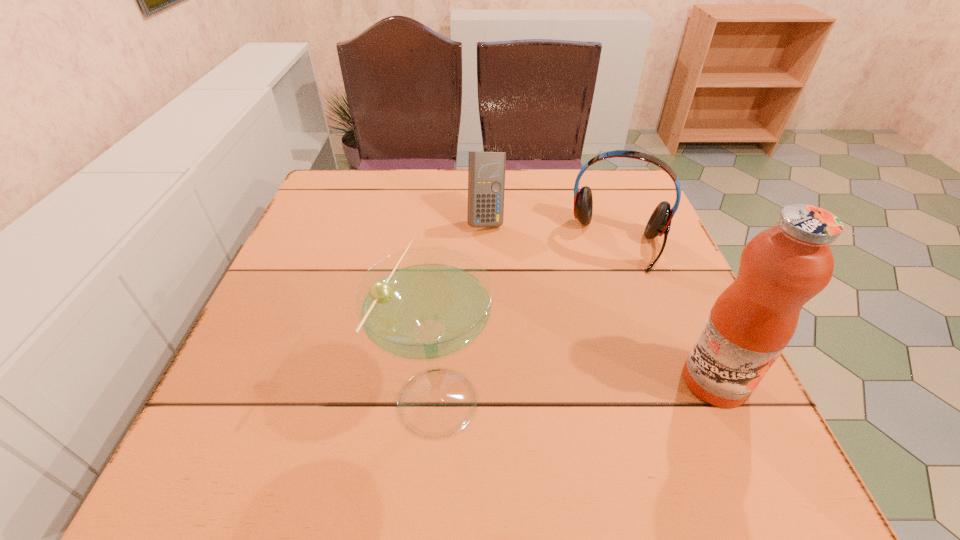
This screenshot has width=960, height=540. I want to click on free space between the headset and the tallest object, so click(x=667, y=312).

The height and width of the screenshot is (540, 960). I want to click on free area in between the fruit juice and the calculator, so click(600, 300).

Identify the location of free space between the martini and the fruit juice. (576, 388).

Where is `object that can be found as the closest to the tallest object`? Image resolution: width=960 pixels, height=540 pixels. object that can be found as the closest to the tallest object is located at coordinates (659, 223).

Select which object appears as the third closest to the headset. Please provide its 2D coordinates. Your answer should be formatted as a tuple, i.e. [(x, y)], where the tuple contains the x and y coordinates of a point satisfying the conditions above.

[(425, 304)]

Where is `free spot that satisfies the following two spatial constraints: 1. on the front side of the headset; 2. on the right side of the calculator`? The image size is (960, 540). free spot that satisfies the following two spatial constraints: 1. on the front side of the headset; 2. on the right side of the calculator is located at coordinates (487, 242).

Identify the location of free point that satisfies the following two spatial constraints: 1. on the back side of the third shortest object; 2. on the right side of the headset. (450, 242).

The width and height of the screenshot is (960, 540). In order to click on vacant space that satisfies the following two spatial constraints: 1. on the back side of the martini; 2. on the right side of the calculator in this screenshot , I will do `click(452, 220)`.

Identify the location of vacant region that satisfies the following two spatial constraints: 1. on the back side of the martini; 2. on the right side of the headset. This screenshot has width=960, height=540. (450, 242).